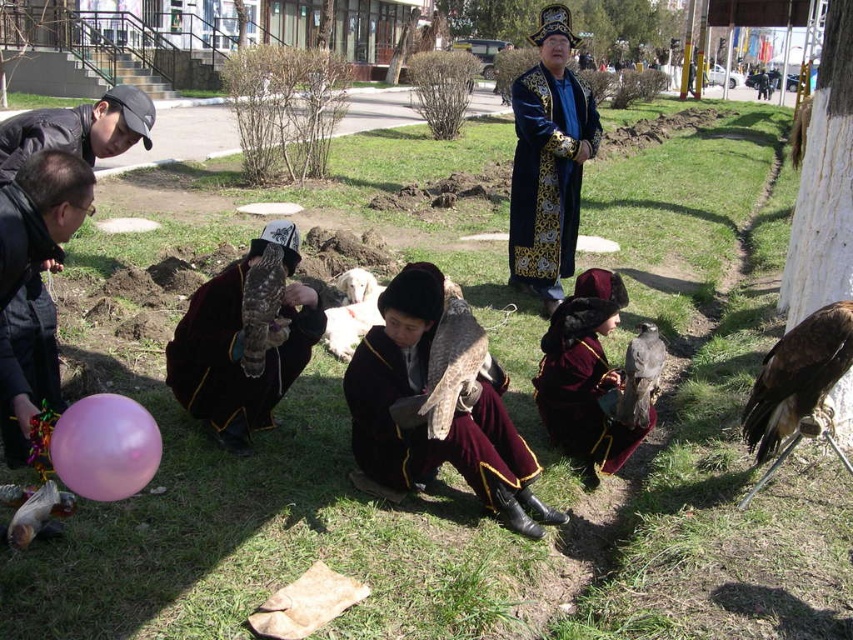
Question: Among these points, which one is nearest to the camera?

Choices:
 (A) pyautogui.click(x=0, y=416)
 (B) pyautogui.click(x=70, y=132)

Answer: (A)

Question: Estimate the real-world distances between objects in this image. Which object is closer to the matte black cap at upper left?

Choices:
 (A) maroon velvet robe at center
 (B) matte black jacket at left
 (C) velvet maroon robe at center

Answer: (B)

Question: Among these points, which one is farthest from the camera?

Choices:
 (A) (57, 376)
 (B) (283, 374)

Answer: (B)

Question: Is maroon velvet robe at center in front of black matte balloon at lower left?

Choices:
 (A) yes
 (B) no

Answer: (B)

Question: Is maroon velvet coat at center to the right of pink rubber balloon at lower left from the viewer's perspective?

Choices:
 (A) no
 (B) yes

Answer: (B)

Question: Does matte black jacket at left lie in front of dark brown feathered falcon at center?

Choices:
 (A) yes
 (B) no

Answer: (A)